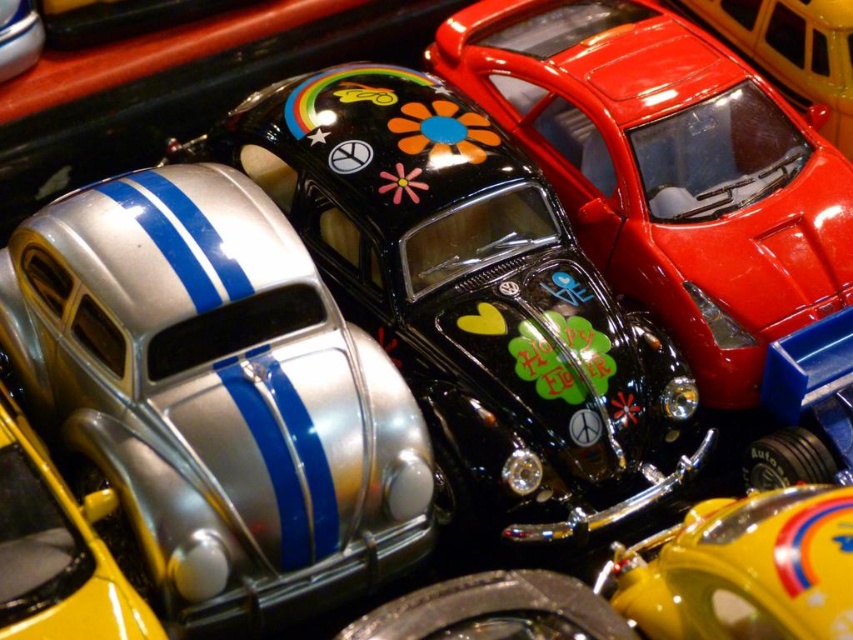
Is silver metallic car at center-left shorter than silver metallic car at lower left?

No, silver metallic car at center-left is not shorter than silver metallic car at lower left.

Does point (494, 387) lie behind point (102, 602)?

Yes.

Who is more distant from viewer, (x=397, y=224) or (x=86, y=589)?

The point (x=397, y=224) is more distant.

Image resolution: width=853 pixels, height=640 pixels. Find the location of `silver metallic car at center-left`. silver metallic car at center-left is located at coordinates pyautogui.click(x=469, y=296).

Is the position of shiny chrome car at center less distant than that of silver metallic car at lower left?

Yes.

Is shiny chrome car at center to the right of silver metallic car at lower left from the viewer's perspective?

Answer: Yes, shiny chrome car at center is to the right of silver metallic car at lower left.

The height and width of the screenshot is (640, 853). What do you see at coordinates (665, 582) in the screenshot? I see `shiny chrome car at center` at bounding box center [665, 582].

The image size is (853, 640). Find the location of `shiny chrome car at center`. shiny chrome car at center is located at coordinates (665, 582).

Which is in front, point (7, 483) or point (817, 54)?

Positioned in front is point (7, 483).

Between silver metallic car at lower left and glossy plastic car at upper center, which one appears on the right side from the viewer's perspective?

From the viewer's perspective, glossy plastic car at upper center appears more on the right side.

Identify the location of silver metallic car at lower left. Image resolution: width=853 pixels, height=640 pixels. (x=55, y=552).